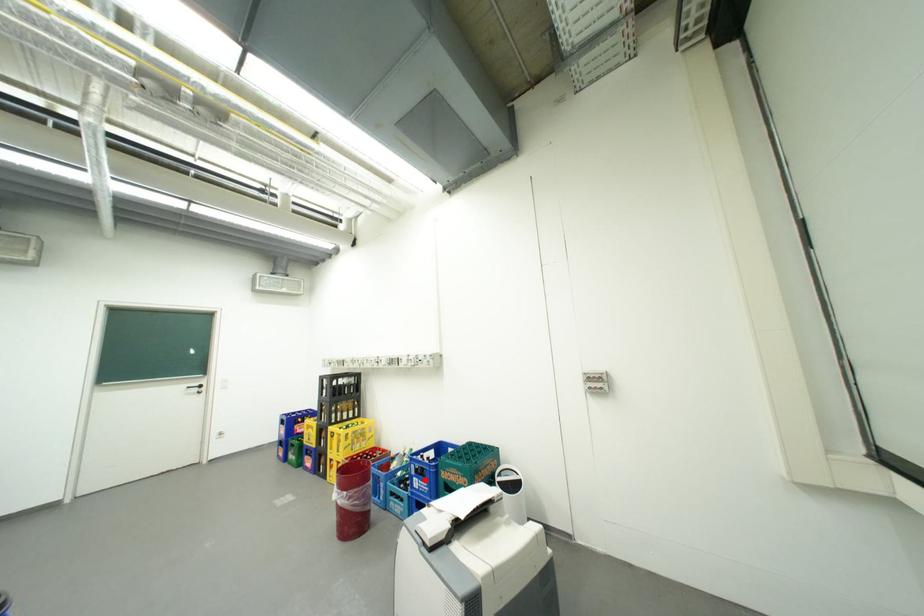
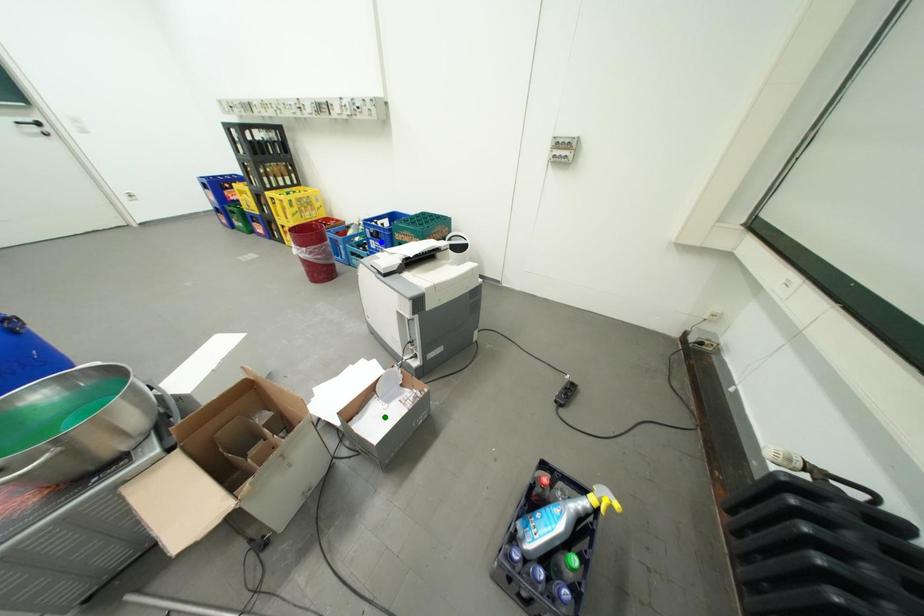
Question: I am providing you with two images of the same scene from different viewpoints. A red point is marked on the first image. You are given multiple points on the second image. In image 2, which mark is for the same physical point as the one in image 1?

Choices:
 (A) yellow point
 (B) green point
 (C) blue point

Answer: (C)